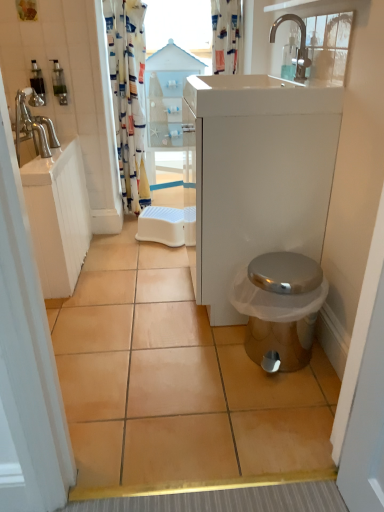
Describe the element at coordinates (37, 81) in the screenshot. This screenshot has width=384, height=512. I see `translucent plastic soap dispenser at upper left, acting as the first toiletry starting from the left` at that location.

What do you see at coordinates (128, 95) in the screenshot? Image resolution: width=384 pixels, height=512 pixels. I see `printed fabric shower curtain at upper left, placed as the 2th shower curtain when sorted from right to left` at bounding box center [128, 95].

Where is `beige ceramic tile at center`? beige ceramic tile at center is located at coordinates (176, 383).

Identify the location of transparent plastic window screen at upper center. (178, 25).

At what (x,y) coordinates should I click in order to perform the action: click on white glossy sink at upper center. Please return your answer as a coordinate pair (x, y). Looking at the image, I should click on (x=257, y=96).

Describe the element at coordinates (257, 175) in the screenshot. The width and height of the screenshot is (384, 512). I see `white glossy cabinet at right` at that location.

This screenshot has height=512, width=384. What do you see at coordinates (328, 45) in the screenshot?
I see `transparent glass window at upper center` at bounding box center [328, 45].

Where is `silver metallic faucet at upper center`? The image size is (384, 512). silver metallic faucet at upper center is located at coordinates (295, 46).

In terms of height, does beige ceramic tile at center look taller or shorter compared to transparent plastic window screen at upper center?

Clearly, beige ceramic tile at center is shorter compared to transparent plastic window screen at upper center.

Considering the sizes of beige ceramic tile at center and transparent plastic window screen at upper center in the image, is beige ceramic tile at center wider or thinner than transparent plastic window screen at upper center?

In the image, beige ceramic tile at center appears to be wider than transparent plastic window screen at upper center.

Is beige ceramic tile at center beside transparent plastic window screen at upper center?

There is a gap between beige ceramic tile at center and transparent plastic window screen at upper center.

Is beige ceramic tile at center turned away from transparent plastic window screen at upper center?

No, beige ceramic tile at center is not facing away from transparent plastic window screen at upper center.

Is printed fabric shower curtain at upper left, marked as the first shower curtain in a left-to-right arrangement, to the right of transparent wood cabinet at center from the viewer's perspective?

Incorrect, printed fabric shower curtain at upper left, marked as the first shower curtain in a left-to-right arrangement, is not on the right side of transparent wood cabinet at center.

Find the location of a particular element. glass door below the printed fabric shower curtain at upper left, marked as the first shower curtain in a left-to-right arrangement (from a real-world perspective) is located at coordinates (169, 118).

Is printed fabric shower curtain at upper left, marked as the first shower curtain in a left-to-right arrangement, completely or partially outside of transparent wood cabinet at center?

printed fabric shower curtain at upper left, marked as the first shower curtain in a left-to-right arrangement, lies outside transparent wood cabinet at center's area.

How much distance is there between printed fabric shower curtain at upper left, placed as the 2th shower curtain when sorted from right to left, and transparent wood cabinet at center?

printed fabric shower curtain at upper left, placed as the 2th shower curtain when sorted from right to left, and transparent wood cabinet at center are 7.98 inches apart.

Considering the sizes of objects metallic silver toilet at lower right and printed fabric shower curtain at upper left, marked as the first shower curtain in a left-to-right arrangement, in the image provided, who is smaller, metallic silver toilet at lower right or printed fabric shower curtain at upper left, marked as the first shower curtain in a left-to-right arrangement,?

metallic silver toilet at lower right.

What are the coordinates of `the 2nd shower curtain to the left of the metallic silver toilet at lower right, starting your count from the anchor` in the screenshot? It's located at (128, 95).

Is metallic silver toilet at lower right next to printed fabric shower curtain at upper left, marked as the first shower curtain in a left-to-right arrangement?

No, metallic silver toilet at lower right is not making contact with printed fabric shower curtain at upper left, marked as the first shower curtain in a left-to-right arrangement.

Considering their positions, is metallic silver toilet at lower right located in front of or behind printed fabric shower curtain at upper left, marked as the first shower curtain in a left-to-right arrangement?

metallic silver toilet at lower right is in front of printed fabric shower curtain at upper left, marked as the first shower curtain in a left-to-right arrangement.

In the scene shown: Between printed fabric shower curtain at upper center, which appears as the 2th shower curtain when viewed from the left, and translucent plastic soap dispenser at upper left, which is the 1th toiletry in right-to-left order, which one appears on the right side from the viewer's perspective?

printed fabric shower curtain at upper center, which appears as the 2th shower curtain when viewed from the left, is more to the right.

Is printed fabric shower curtain at upper center, which is the 1th shower curtain in right-to-left order, closer to camera compared to translucent plastic soap dispenser at upper left, acting as the 2th toiletry starting from the left?

No, it is not.

From the image's perspective, is printed fabric shower curtain at upper center, which appears as the 2th shower curtain when viewed from the left, beneath translucent plastic soap dispenser at upper left, acting as the 2th toiletry starting from the left?

No, from the image's perspective, printed fabric shower curtain at upper center, which appears as the 2th shower curtain when viewed from the left, is not below translucent plastic soap dispenser at upper left, acting as the 2th toiletry starting from the left.

Is translucent plastic soap dispenser at upper left, acting as the 2th toiletry starting from the left, oriented towards beige ceramic tile at center?

No, translucent plastic soap dispenser at upper left, acting as the 2th toiletry starting from the left, is not turned towards beige ceramic tile at center.

How many degrees apart are the facing directions of translucent plastic soap dispenser at upper left, acting as the 2th toiletry starting from the left, and beige ceramic tile at center?

The facing directions of translucent plastic soap dispenser at upper left, acting as the 2th toiletry starting from the left, and beige ceramic tile at center are 0.689 degrees apart.

Is translucent plastic soap dispenser at upper left, which is the 1th toiletry in right-to-left order, far away from beige ceramic tile at center?

Yes, translucent plastic soap dispenser at upper left, which is the 1th toiletry in right-to-left order, and beige ceramic tile at center are quite far apart.

Identify the location of the 2nd toiletry behind the beige ceramic tile at center. This screenshot has height=512, width=384. (59, 83).

From a real-world perspective, which object rests below the other?

metallic silver toilet at lower right, from a real-world perspective.

At what (x,y) coordinates should I click in order to perform the action: click on toilet on the right side of translucent plastic soap dispenser at upper left, which is the 1th toiletry in right-to-left order. Please return your answer as a coordinate pair (x, y). This screenshot has width=384, height=512. Looking at the image, I should click on (280, 306).

What's the angular difference between metallic silver toilet at lower right and translucent plastic soap dispenser at upper left, which is the 1th toiletry in right-to-left order,'s facing directions?

The angular difference between metallic silver toilet at lower right and translucent plastic soap dispenser at upper left, which is the 1th toiletry in right-to-left order, is 88.6 degrees.

Does metallic silver toilet at lower right appear on the left side of translucent plastic soap dispenser at upper left, acting as the 2th toiletry starting from the left?

Incorrect, metallic silver toilet at lower right is not on the left side of translucent plastic soap dispenser at upper left, acting as the 2th toiletry starting from the left.

From the image's perspective, which one is positioned lower, translucent plastic soap dispenser at upper left, acting as the first toiletry starting from the left, or printed fabric shower curtain at upper left, placed as the 2th shower curtain when sorted from right to left?

From the image's view, printed fabric shower curtain at upper left, placed as the 2th shower curtain when sorted from right to left, is below.

In the scene shown: Is translucent plastic soap dispenser at upper left, acting as the first toiletry starting from the left, turned away from printed fabric shower curtain at upper left, placed as the 2th shower curtain when sorted from right to left?

No, translucent plastic soap dispenser at upper left, acting as the first toiletry starting from the left, is not facing the opposite direction of printed fabric shower curtain at upper left, placed as the 2th shower curtain when sorted from right to left.

From a real-world perspective, which toiletry is the 1st one above the printed fabric shower curtain at upper left, placed as the 2th shower curtain when sorted from right to left? Please provide its 2D coordinates.

[(37, 81)]

From a real-world perspective, which object rests below the other?

From a 3D spatial view, printed fabric shower curtain at upper left, marked as the first shower curtain in a left-to-right arrangement, is below.

Locate an element on the screen. ceramic tile on the left of transparent plastic window screen at upper center is located at coordinates (176, 383).

The width and height of the screenshot is (384, 512). Find the location of `the 2nd shower curtain in front of the transparent wood cabinet at center, starting your count from the anchor`. the 2nd shower curtain in front of the transparent wood cabinet at center, starting your count from the anchor is located at coordinates (128, 95).

Looking at this image, considering their positions, is transparent plastic window screen at upper center positioned closer to translucent plastic soap dispenser at upper left, acting as the 2th toiletry starting from the left, than metallic silver toilet at lower right?

transparent plastic window screen at upper center is closer to translucent plastic soap dispenser at upper left, acting as the 2th toiletry starting from the left.

Considering their positions, is printed fabric shower curtain at upper left, placed as the 2th shower curtain when sorted from right to left, positioned closer to beige ceramic tile at center than transparent wood cabinet at center?

The object closer to beige ceramic tile at center is printed fabric shower curtain at upper left, placed as the 2th shower curtain when sorted from right to left.

Which object lies further to the anchor point printed fabric shower curtain at upper center, which is the 1th shower curtain in right-to-left order, white glossy sink at upper center or silver metallic faucet at upper center?

The object further to printed fabric shower curtain at upper center, which is the 1th shower curtain in right-to-left order, is white glossy sink at upper center.

From the image, which object appears to be nearer to translucent plastic soap dispenser at upper left, acting as the 2th toiletry starting from the left, transparent wood cabinet at center or silver metallic faucet at upper center?

transparent wood cabinet at center.

When comparing their distances from translucent plastic soap dispenser at upper left, which is the 1th toiletry in right-to-left order, does printed fabric shower curtain at upper left, placed as the 2th shower curtain when sorted from right to left, or transparent plastic window screen at upper center seem closer?

printed fabric shower curtain at upper left, placed as the 2th shower curtain when sorted from right to left, is positioned closer to the anchor translucent plastic soap dispenser at upper left, which is the 1th toiletry in right-to-left order.

Based on their spatial positions, is printed fabric shower curtain at upper center, which appears as the 2th shower curtain when viewed from the left, or translucent plastic soap dispenser at upper left, positioned as the second toiletry in right-to-left order, closer to white glossy cabinet at right?

printed fabric shower curtain at upper center, which appears as the 2th shower curtain when viewed from the left, is closer to white glossy cabinet at right.

When comparing their distances from printed fabric shower curtain at upper center, which is the 1th shower curtain in right-to-left order, does beige ceramic tile at center or white glossy sink at upper center seem closer?

white glossy sink at upper center is positioned closer to the anchor printed fabric shower curtain at upper center, which is the 1th shower curtain in right-to-left order.

From the image, which object appears to be nearer to beige ceramic tile at center, silver metallic faucet at upper center or metallic silver toilet at lower right?

metallic silver toilet at lower right is closer to beige ceramic tile at center.

The height and width of the screenshot is (512, 384). I want to click on window screen between translucent plastic soap dispenser at upper left, acting as the 2th toiletry starting from the left, and printed fabric shower curtain at upper center, which is the 1th shower curtain in right-to-left order, from left to right, so click(x=178, y=25).

Locate an element on the screen. The width and height of the screenshot is (384, 512). bathroom cabinet between transparent glass window at upper center and metallic silver toilet at lower right vertically is located at coordinates (257, 175).

Locate an element on the screen. The height and width of the screenshot is (512, 384). window located between beige ceramic tile at center and transparent wood cabinet at center in the depth direction is located at coordinates (328, 45).

Where is `window between printed fabric shower curtain at upper center, which appears as the 2th shower curtain when viewed from the left, and beige ceramic tile at center from top to bottom`? This screenshot has height=512, width=384. window between printed fabric shower curtain at upper center, which appears as the 2th shower curtain when viewed from the left, and beige ceramic tile at center from top to bottom is located at coordinates (328, 45).